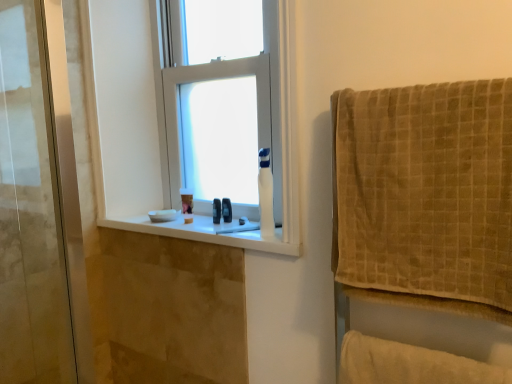
Question: Does beige soft towel at lower right have a larger size compared to white glossy toilet paper at center?

Choices:
 (A) no
 (B) yes

Answer: (B)

Question: Considering the relative positions of beige soft towel at lower right and white glossy toilet paper at center in the image provided, is beige soft towel at lower right behind white glossy toilet paper at center?

Choices:
 (A) no
 (B) yes

Answer: (A)

Question: Does beige soft towel at lower right appear on the right side of white glossy toilet paper at center?

Choices:
 (A) no
 (B) yes

Answer: (B)

Question: Is beige soft towel at lower right positioned before white glossy toilet paper at center?

Choices:
 (A) yes
 (B) no

Answer: (A)

Question: Considering the relative sizes of beige soft towel at lower right and white glossy toilet paper at center in the image provided, is beige soft towel at lower right smaller than white glossy toilet paper at center?

Choices:
 (A) no
 (B) yes

Answer: (A)

Question: Is beige soft towel at lower right wider than white glossy toilet paper at center?

Choices:
 (A) yes
 (B) no

Answer: (B)

Question: Is black rubber ring at window oriented towards white plastic window at center?

Choices:
 (A) yes
 (B) no

Answer: (B)

Question: Is white plastic window at center surrounded by black rubber ring at window?

Choices:
 (A) no
 (B) yes

Answer: (A)

Question: Does black rubber ring at window appear on the right side of white plastic window at center?

Choices:
 (A) no
 (B) yes

Answer: (B)

Question: Can you confirm if black rubber ring at window is smaller than white plastic window at center?

Choices:
 (A) no
 (B) yes

Answer: (B)

Question: From a real-world perspective, is black rubber ring at window physically above white plastic window at center?

Choices:
 (A) yes
 (B) no

Answer: (B)

Question: Considering the relative sizes of black rubber ring at window and white plastic window at center in the image provided, is black rubber ring at window wider than white plastic window at center?

Choices:
 (A) yes
 (B) no

Answer: (B)

Question: From the image's perspective, would you say white glossy toilet paper at center is positioned over black rubber ring at window?

Choices:
 (A) no
 (B) yes

Answer: (B)